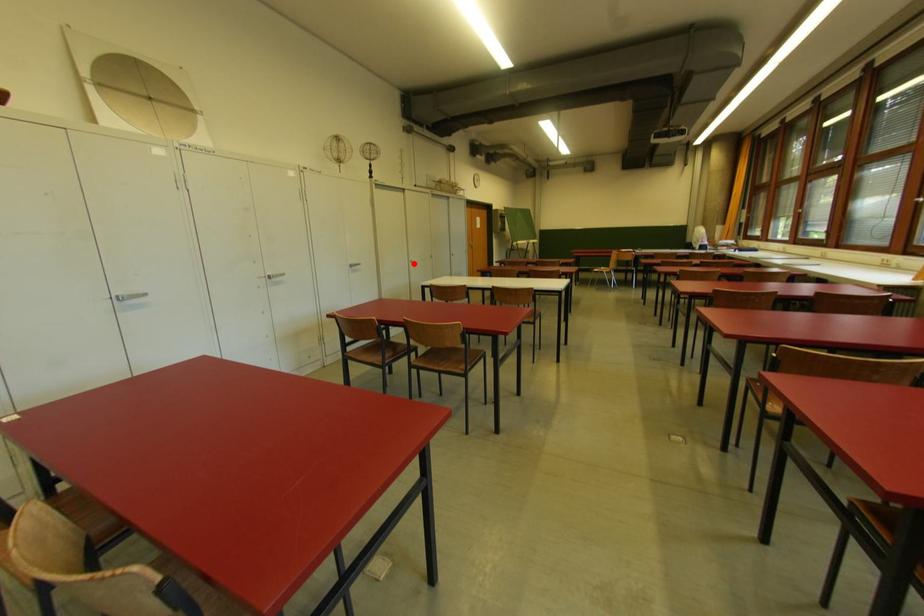
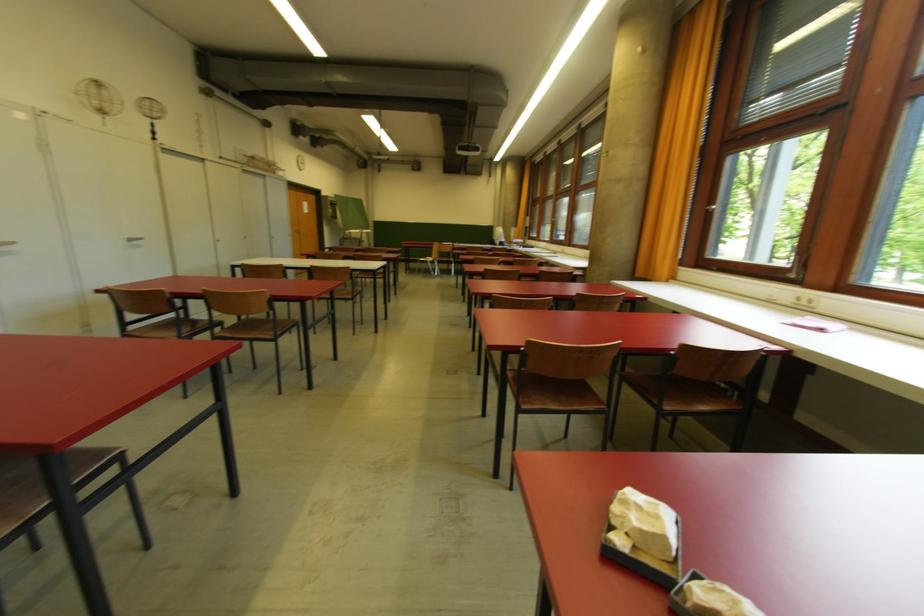
Locate, in the second image, the point that corresponds to the highlighted location in the first image.

(221, 243)